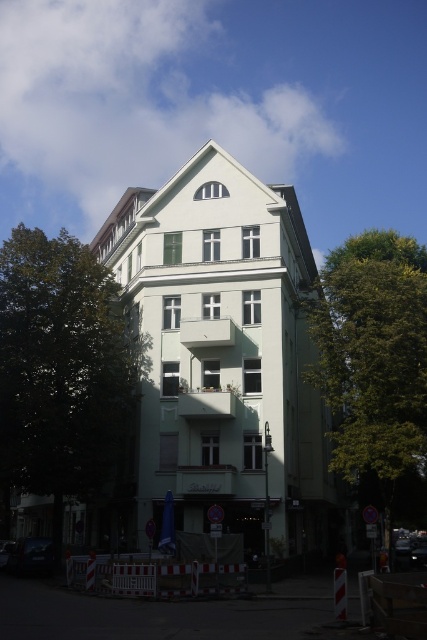
Question: From the image, what is the correct spatial relationship of green leafy tree at left in relation to green leafy tree at center?

Choices:
 (A) below
 (B) above

Answer: (B)

Question: Which object appears farthest from the camera in this image?

Choices:
 (A) green leafy tree at center
 (B) green leafy tree at left

Answer: (B)

Question: Is green leafy tree at left closer to the viewer compared to green leafy tree at center?

Choices:
 (A) yes
 (B) no

Answer: (B)

Question: Which object appears farthest from the camera in this image?

Choices:
 (A) green leafy tree at left
 (B) green leafy tree at center

Answer: (A)

Question: Does green leafy tree at left have a lesser width compared to green leafy tree at center?

Choices:
 (A) no
 (B) yes

Answer: (A)